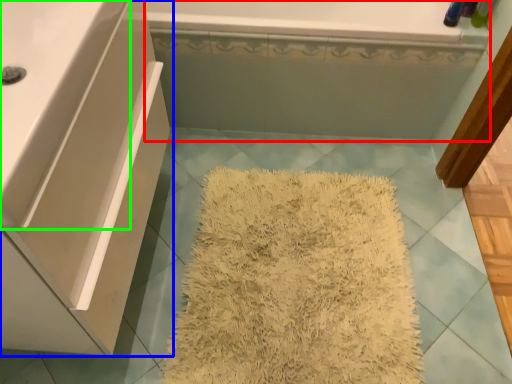
Question: Which is farther away from bath (highlighted by a red box)? bathroom cabinet (highlighted by a blue box) or counter top (highlighted by a green box)?

Choices:
 (A) bathroom cabinet
 (B) counter top

Answer: (B)